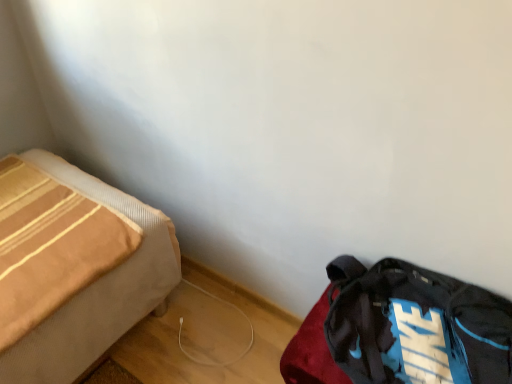
Image resolution: width=512 pixels, height=384 pixels. What do you see at coordinates (401, 329) in the screenshot?
I see `matte black backpack at lower right` at bounding box center [401, 329].

The height and width of the screenshot is (384, 512). Find the location of `matte black backpack at lower right`. matte black backpack at lower right is located at coordinates (401, 329).

In order to face matte black backpack at lower right, should I rotate leftwards or rightwards?

To align with it, rotate right about 18.618°.

Find the location of a particular element. matte black backpack at lower right is located at coordinates (401, 329).